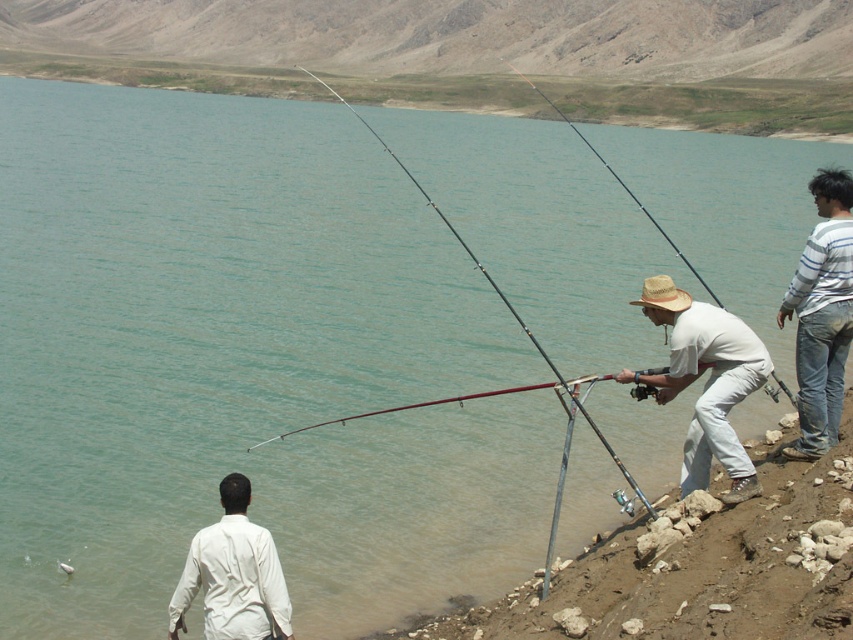
Measure the distance between black rod fishing pole at center and silvery metallic fish at lower left.

They are 43.56 meters apart.

Which is below, black rod fishing pole at center or silvery metallic fish at lower left?

Positioned lower is silvery metallic fish at lower left.

Image resolution: width=853 pixels, height=640 pixels. In order to click on black rod fishing pole at center in this screenshot , I will do `click(621, 186)`.

The width and height of the screenshot is (853, 640). Identify the location of black rod fishing pole at center. (621, 186).

Which is below, metallic fishing rod at lower right or white matte shirt at lower left?

metallic fishing rod at lower right

Who is more forward, (631, 609) or (289, 630)?

Positioned in front is point (289, 630).

What are the coordinates of `metallic fishing rod at lower right` in the screenshot? It's located at (693, 573).

Is white cotton shirt at center closer to the viewer compared to white matte shirt at lower left?

No.

This screenshot has height=640, width=853. What do you see at coordinates (706, 380) in the screenshot?
I see `white cotton shirt at center` at bounding box center [706, 380].

The image size is (853, 640). What are the coordinates of `white cotton shirt at center` in the screenshot? It's located at (706, 380).